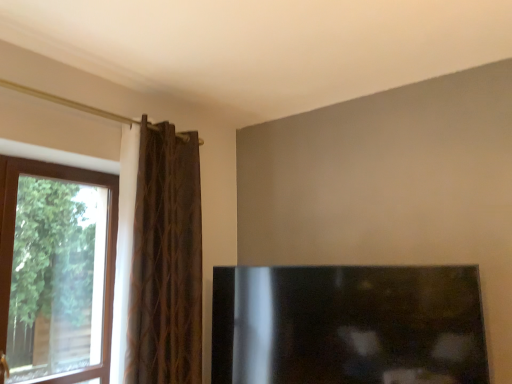
Question: Can you confirm if black glossy fireplace at lower right is thinner than transparent glass window at left?

Choices:
 (A) no
 (B) yes

Answer: (B)

Question: Is black glossy fireplace at lower right positioned far away from transparent glass window at left?

Choices:
 (A) no
 (B) yes

Answer: (B)

Question: From the image's perspective, does black glossy fireplace at lower right appear lower than transparent glass window at left?

Choices:
 (A) no
 (B) yes

Answer: (B)

Question: Does black glossy fireplace at lower right have a lesser height compared to transparent glass window at left?

Choices:
 (A) yes
 (B) no

Answer: (A)

Question: From a real-world perspective, is black glossy fireplace at lower right positioned under transparent glass window at left based on gravity?

Choices:
 (A) yes
 (B) no

Answer: (A)

Question: Can you confirm if black glossy fireplace at lower right is taller than transparent glass window at left?

Choices:
 (A) yes
 (B) no

Answer: (B)

Question: From a real-world perspective, is transparent glass window at left physically above black glossy fireplace at lower right?

Choices:
 (A) yes
 (B) no

Answer: (A)

Question: Considering the relative positions of transparent glass window at left and black glossy fireplace at lower right in the image provided, is transparent glass window at left behind black glossy fireplace at lower right?

Choices:
 (A) yes
 (B) no

Answer: (A)

Question: Considering the relative sizes of transparent glass window at left and black glossy fireplace at lower right in the image provided, is transparent glass window at left wider than black glossy fireplace at lower right?

Choices:
 (A) no
 (B) yes

Answer: (B)

Question: Could you tell me if transparent glass window at left is turned towards black glossy fireplace at lower right?

Choices:
 (A) yes
 (B) no

Answer: (B)

Question: Is black glossy fireplace at lower right surrounded by transparent glass window at left?

Choices:
 (A) no
 (B) yes

Answer: (A)

Question: Is transparent glass window at left to the left of black glossy fireplace at lower right from the viewer's perspective?

Choices:
 (A) no
 (B) yes

Answer: (B)

Question: Is black glossy fireplace at lower right taller than brown textured curtain at left?

Choices:
 (A) yes
 (B) no

Answer: (B)